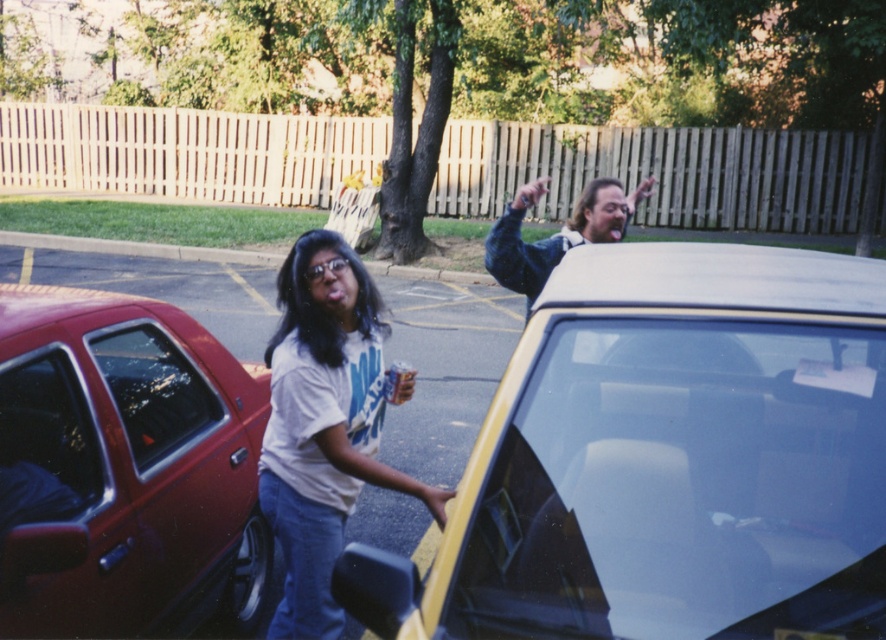
Question: Which point appears farthest from the camera in this image?

Choices:
 (A) (35, 396)
 (B) (378, 321)
 (C) (488, 269)
 (D) (628, 200)

Answer: (D)

Question: Does metallic yellow car at center appear over white matte t-shirt at center?

Choices:
 (A) yes
 (B) no

Answer: (A)

Question: From the image, what is the correct spatial relationship of white matte t-shirt at center in relation to matte plastic hand at upper center?

Choices:
 (A) above
 (B) below

Answer: (B)

Question: From the image, what is the correct spatial relationship of metallic yellow car at center in relation to white matte t-shirt at center?

Choices:
 (A) right
 (B) left

Answer: (A)

Question: Which object is closer to the camera taking this photo?

Choices:
 (A) shiny red car at left
 (B) matte plastic hand at upper center
 (C) denim jacket at upper right

Answer: (A)

Question: Which object is the farthest from the metallic yellow car at center?

Choices:
 (A) shiny red car at left
 (B) smooth yellow car door handle at lower center

Answer: (A)